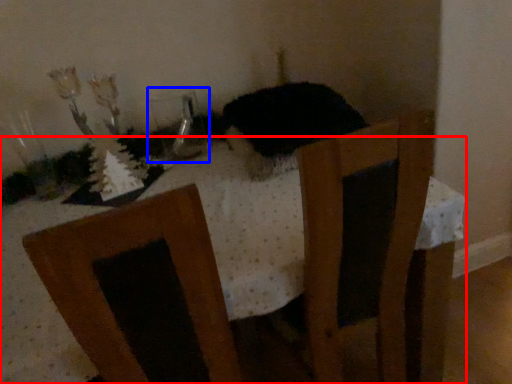
Question: Which of the following is the closest to the observer, table (highlighted by a red box) or glass vase (highlighted by a blue box)?

Choices:
 (A) table
 (B) glass vase

Answer: (A)